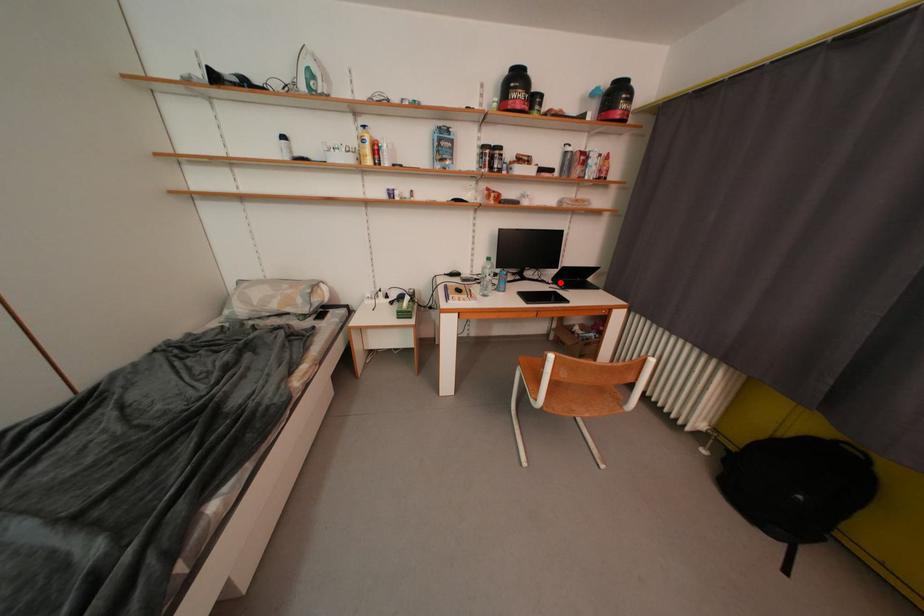
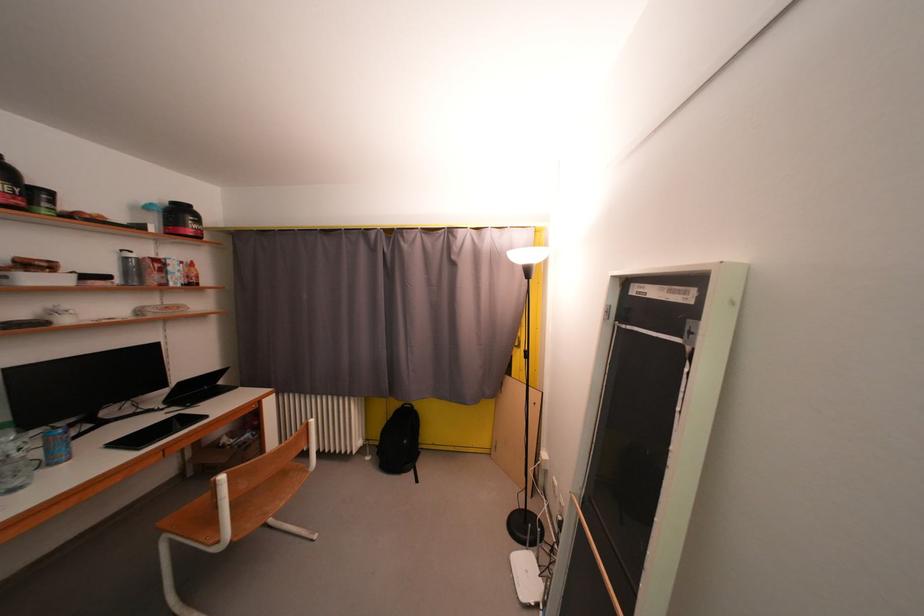
Where in the second image is the point corresponding to the highlighted location from the first image?

(174, 405)